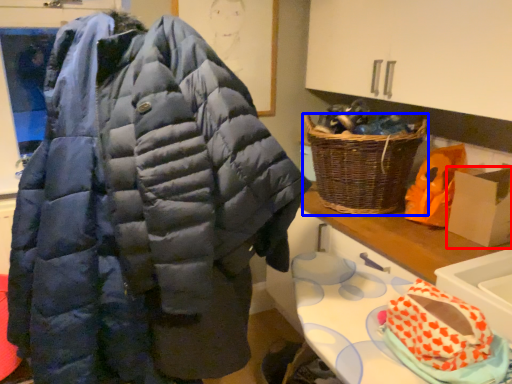
Question: Among these objects, which one is farthest to the camera, cardboard box (highlighted by a red box) or picnic basket (highlighted by a blue box)?

Choices:
 (A) cardboard box
 (B) picnic basket

Answer: (B)